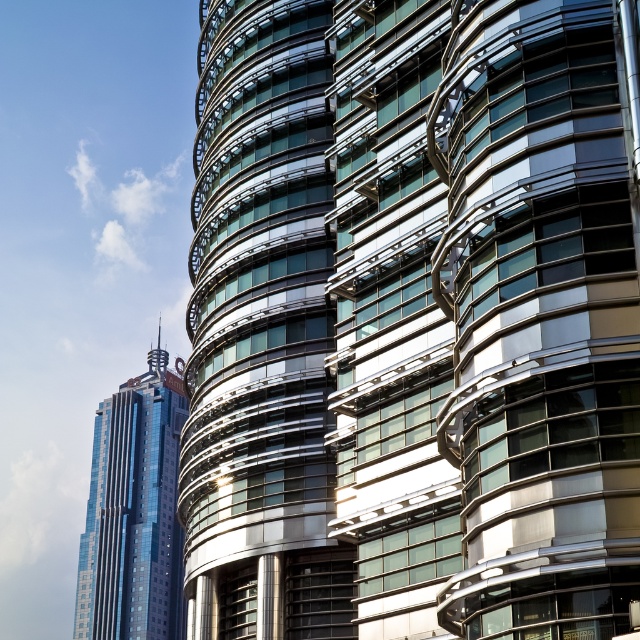
Does point (198, 214) come closer to viewer compared to point (120, 477)?

Yes, it is.

Which is more to the left, glassy metallic skyscraper at center or shiny blue glass skyscraper at left?

From the viewer's perspective, shiny blue glass skyscraper at left appears more on the left side.

Find the location of a particular element. This screenshot has width=640, height=640. glassy metallic skyscraper at center is located at coordinates (412, 323).